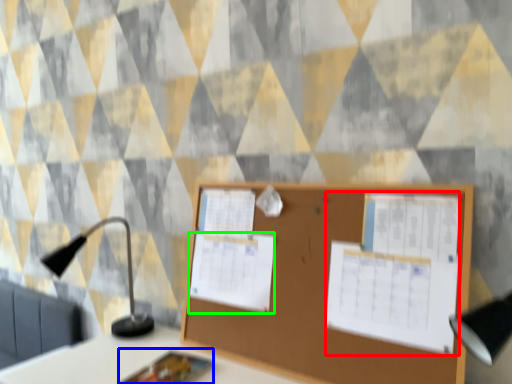
Question: Estimate the real-world distances between objects in this image. Which object is closer to poster (highlighted by a red box), notebook (highlighted by a blue box) or poster (highlighted by a green box)?

Choices:
 (A) notebook
 (B) poster

Answer: (B)